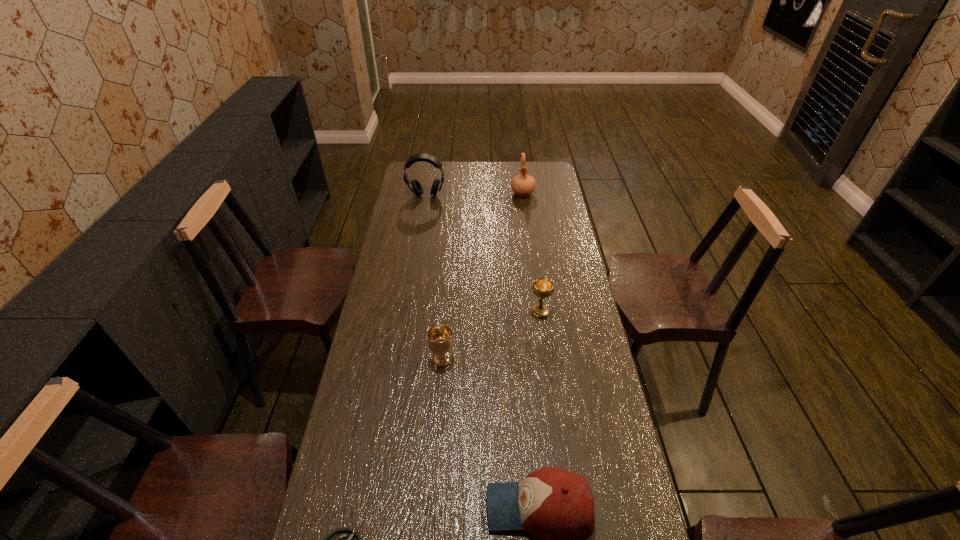
Select which object appears as the second closest to the ashtray. Please provide its 2D coordinates. Your answer should be formatted as a tuple, i.e. [(x, y)], where the tuple contains the x and y coordinates of a point satisfying the conditions above.

[(440, 340)]

Where is `object that stands as the second closest to the baseball cap`? The width and height of the screenshot is (960, 540). object that stands as the second closest to the baseball cap is located at coordinates (440, 340).

I want to click on free point that satisfies the following two spatial constraints: 1. on the spout of the fourth nearest object; 2. on the right side of the pottery, so click(x=539, y=312).